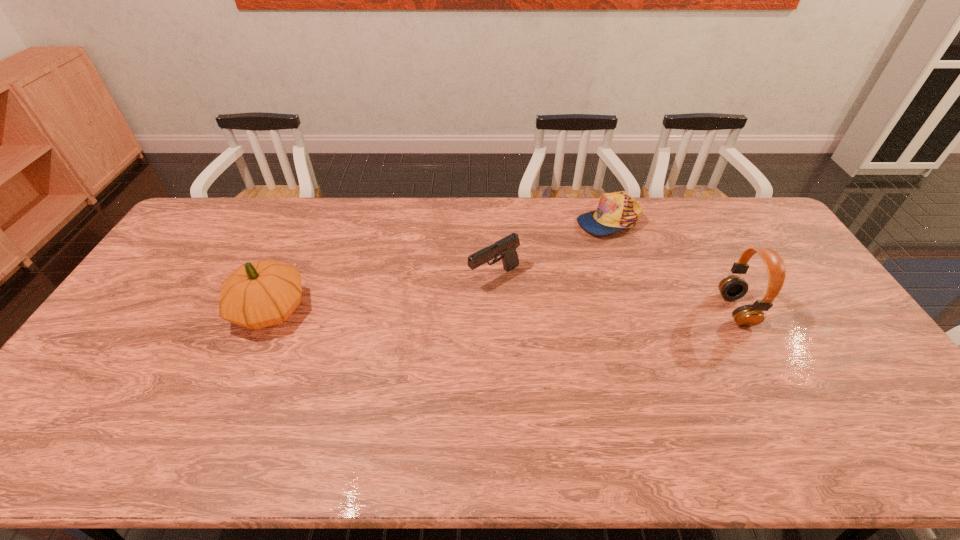
This screenshot has height=540, width=960. In order to click on vacant space at the far edge of the desktop in this screenshot , I will do tap(305, 207).

At what (x,y) coordinates should I click in order to perform the action: click on vacant space at the near edge of the desktop. Please return your answer as a coordinate pair (x, y). The image size is (960, 540). Looking at the image, I should click on (475, 406).

In the image, there is a desktop. At what (x,y) coordinates should I click in order to perform the action: click on free space at the right edge. Please return your answer as a coordinate pair (x, y). This screenshot has height=540, width=960. Looking at the image, I should click on (829, 339).

This screenshot has height=540, width=960. Identify the location of free space at the far left corner of the desktop. (209, 211).

At what (x,y) coordinates should I click in order to perform the action: click on vacant area that lies between the second shortest object and the rightmost object. Please return your answer as a coordinate pair (x, y). This screenshot has height=540, width=960. Looking at the image, I should click on (614, 293).

I want to click on vacant area that lies between the second shortest object and the gourd, so click(382, 293).

The width and height of the screenshot is (960, 540). Identify the location of vacant point located between the headset and the pistol. (614, 293).

The height and width of the screenshot is (540, 960). Identify the location of free point between the second tallest object and the headset. (503, 310).

At what (x,y) coordinates should I click in order to perform the action: click on free space between the second tallest object and the third object from right to left. Please return your answer as a coordinate pair (x, y). Looking at the image, I should click on (382, 293).

Where is `vacant point located between the cap and the rightmost object`? This screenshot has width=960, height=540. vacant point located between the cap and the rightmost object is located at coordinates (672, 265).